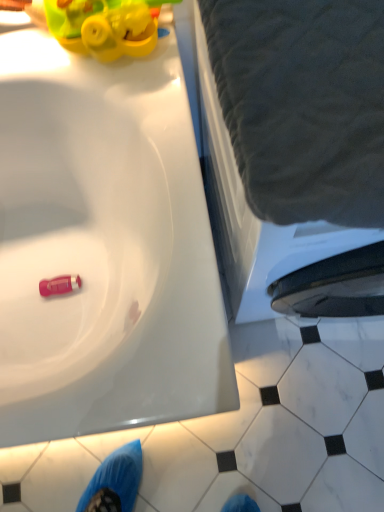
What is the approximate width of pink rubber toy at lower left?

The width of pink rubber toy at lower left is 2.49 inches.

The height and width of the screenshot is (512, 384). Find the location of `white marble tile at lower right`. white marble tile at lower right is located at coordinates (344, 488).

I want to click on pink rubber toy at lower left, so click(x=59, y=285).

Can we say gray fabric at upper right lies outside pink rubber toy at lower left?

Yes, gray fabric at upper right is located beyond the bounds of pink rubber toy at lower left.

Is point (245, 199) positioned before point (54, 283)?

Yes.

The width and height of the screenshot is (384, 512). Find the location of `bath that is above the pink rubber toy at lower left (from a real-world perspective)`. bath that is above the pink rubber toy at lower left (from a real-world perspective) is located at coordinates (280, 238).

Based on the photo, is gray fabric at upper right oriented towards pink rubber toy at lower left?

No, gray fabric at upper right does not turn towards pink rubber toy at lower left.

Is pink rubber toy at lower left oriented towards white marble tile at lower right?

No, pink rubber toy at lower left is not facing towards white marble tile at lower right.

Is pink rubber toy at lower left in front of or behind white marble tile at lower right in the image?

pink rubber toy at lower left is behind white marble tile at lower right.

Can you tell me how much pink rubber toy at lower left and white marble tile at lower right differ in facing direction?

The facing directions of pink rubber toy at lower left and white marble tile at lower right are 117 degrees apart.

In the scene shown: Considering the sizes of objects pink rubber toy at lower left and white marble tile at lower right in the image provided, who is smaller, pink rubber toy at lower left or white marble tile at lower right?

pink rubber toy at lower left.

Is point (330, 468) positioned behind point (67, 279)?

Yes.

From the image's perspective, is white marble tile at lower right located above or below pink rubber toy at lower left?

white marble tile at lower right is situated lower than pink rubber toy at lower left in the image.

Identify the location of toy lying on the left of white marble tile at lower right. This screenshot has width=384, height=512. (59, 285).

Is white marble tile at lower right to the left or to the right of pink rubber toy at lower left in the image?

Based on their positions, white marble tile at lower right is located to the right of pink rubber toy at lower left.

Is white marble tile at lower right located outside gray fabric at upper right?

That's correct, white marble tile at lower right is outside of gray fabric at upper right.

Is white marble tile at lower right next to gray fabric at upper right?

No.

Is the depth of white marble tile at lower right greater than that of gray fabric at upper right?

Yes, it is behind gray fabric at upper right.

Between gray fabric at upper right and white marble tile at lower right, which one has less height?

white marble tile at lower right is shorter.

From the image's perspective, does gray fabric at upper right appear higher than white marble tile at lower right?

Indeed, from the image's perspective, gray fabric at upper right is shown above white marble tile at lower right.

Is gray fabric at upper right at the left side of white marble tile at lower right?

Indeed, gray fabric at upper right is positioned on the left side of white marble tile at lower right.

Based on the photo, is gray fabric at upper right further to the viewer compared to white marble tile at lower right?

No, the depth of gray fabric at upper right is less than that of white marble tile at lower right.

Looking at their sizes, would you say pink rubber toy at lower left is wider or thinner than gray fabric at upper right?

In the image, pink rubber toy at lower left appears to be more narrow than gray fabric at upper right.

Could you tell me if pink rubber toy at lower left is facing gray fabric at upper right?

No, pink rubber toy at lower left is not turned towards gray fabric at upper right.

Is pink rubber toy at lower left shorter than gray fabric at upper right?

Indeed, pink rubber toy at lower left has a lesser height compared to gray fabric at upper right.

You are a GUI agent. You are given a task and a screenshot of the screen. Output one action in this format:
    pyautogui.click(x=<x>, y=<y>)
    Task: Click on the bath on the right side of pink rubber toy at lower left
    The height and width of the screenshot is (512, 384).
    Given the screenshot: What is the action you would take?
    pyautogui.click(x=280, y=238)

Find the location of a particular element. toy above the white marble tile at lower right (from a real-world perspective) is located at coordinates (59, 285).

Estimate the real-world distances between objects in this image. Which object is further from white marble tile at lower right, pink rubber toy at lower left or gray fabric at upper right?

The object further to white marble tile at lower right is pink rubber toy at lower left.

Considering their positions, is gray fabric at upper right positioned closer to white marble tile at lower right than pink rubber toy at lower left?

gray fabric at upper right.

Which object lies further to the anchor point gray fabric at upper right, white marble tile at lower right or pink rubber toy at lower left?

The object further to gray fabric at upper right is white marble tile at lower right.

Based on their spatial positions, is gray fabric at upper right or white marble tile at lower right closer to pink rubber toy at lower left?

gray fabric at upper right.

In the scene shown: Looking at the image, which one is located further to pink rubber toy at lower left, white marble tile at lower right or gray fabric at upper right?

white marble tile at lower right is further to pink rubber toy at lower left.

When comparing their distances from gray fabric at upper right, does pink rubber toy at lower left or white marble tile at lower right seem closer?

pink rubber toy at lower left is positioned closer to the anchor gray fabric at upper right.

You are a GUI agent. You are given a task and a screenshot of the screen. Output one action in this format:
    pyautogui.click(x=<x>, y=<y>)
    Task: Click on the toy between gray fabric at upper right and white marble tile at lower right in the vertical direction
    This screenshot has height=512, width=384.
    Given the screenshot: What is the action you would take?
    pyautogui.click(x=59, y=285)